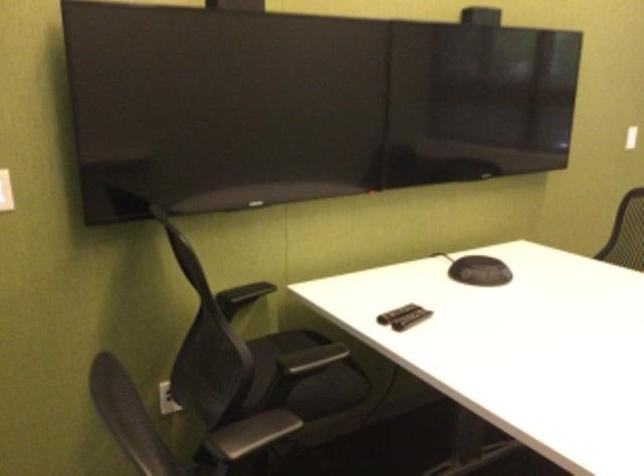
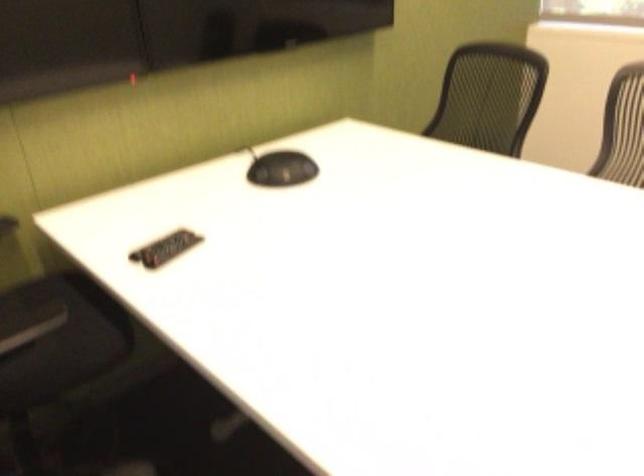
What movement of the cameraman would produce the second image?

The movement direction of the cameraman is right, forward.